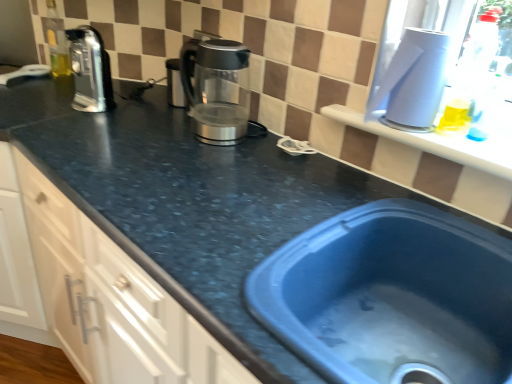
You are a GUI agent. You are given a task and a screenshot of the screen. Output one action in this format:
    pyautogui.click(x=<x>, y=<y>)
    Task: Click on the free spot in front of sleek metallic kettle at center
    This screenshot has height=384, width=512.
    Given the screenshot: What is the action you would take?
    pyautogui.click(x=219, y=172)